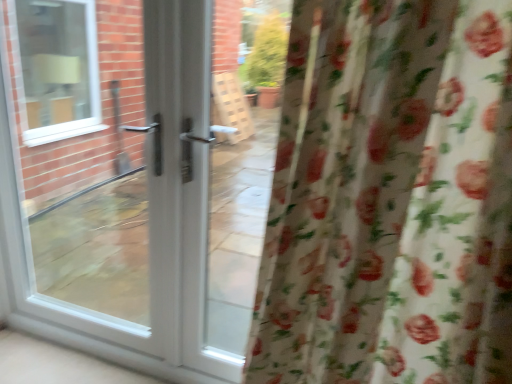
Question: Considering the positions of white glossy door at center and floral fabric curtain at right in the image, is white glossy door at center wider or thinner than floral fabric curtain at right?

Choices:
 (A) wide
 (B) thin

Answer: (B)

Question: Looking at the image, does white glossy door at center seem bigger or smaller compared to floral fabric curtain at right?

Choices:
 (A) small
 (B) big

Answer: (B)

Question: Choose the correct answer: Is white glossy door at center inside floral fabric curtain at right or outside it?

Choices:
 (A) outside
 (B) inside

Answer: (A)

Question: Is floral fabric curtain at right to the left or to the right of white glossy door at center in the image?

Choices:
 (A) right
 (B) left

Answer: (A)

Question: Relative to white glossy door at center, is floral fabric curtain at right in front or behind?

Choices:
 (A) behind
 (B) front

Answer: (B)

Question: Looking at the image, does floral fabric curtain at right seem bigger or smaller compared to white glossy door at center?

Choices:
 (A) big
 (B) small

Answer: (B)

Question: From the image's perspective, relative to white glossy door at center, is floral fabric curtain at right above or below?

Choices:
 (A) below
 (B) above

Answer: (A)